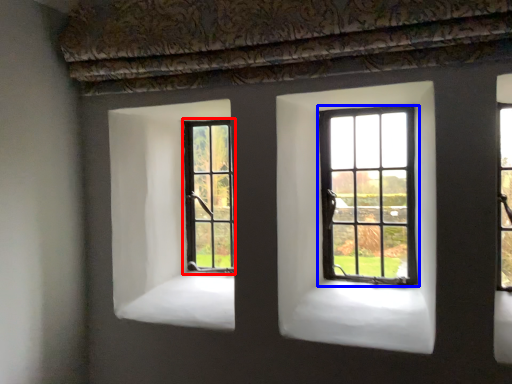
Question: Which object appears closest to the camera in this image, window (highlighted by a red box) or window (highlighted by a blue box)?

Choices:
 (A) window
 (B) window

Answer: (B)